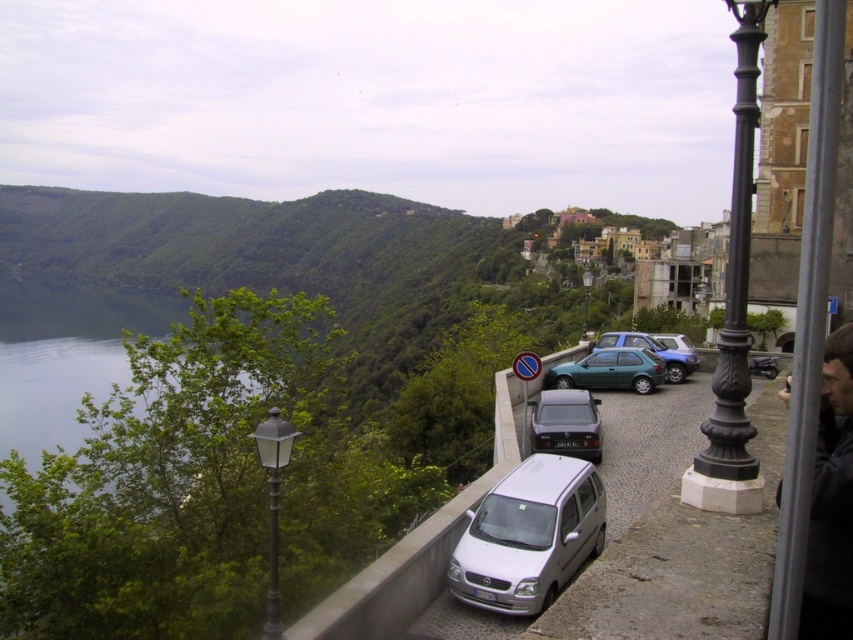
Between point (585, 435) and point (675, 364), which one is positioned in front?

Point (585, 435) is in front.

Can you confirm if metallic gray sedan at center is taller than metallic blue hatchback at center?

Incorrect, metallic gray sedan at center's height is not larger of metallic blue hatchback at center's.

This screenshot has width=853, height=640. Find the location of `metallic gray sedan at center`. metallic gray sedan at center is located at coordinates (566, 422).

You are a GUI agent. You are given a task and a screenshot of the screen. Output one action in this format:
    pyautogui.click(x=<x>, y=<y>)
    Task: Click on the metallic gray sedan at center
    This screenshot has width=853, height=640.
    Given the screenshot: What is the action you would take?
    pyautogui.click(x=566, y=422)

Does black metal pole at right have a lesser height compared to black metal lamp post at center?

No.

Which is behind, point (741, 269) or point (584, 333)?

Point (584, 333)

The width and height of the screenshot is (853, 640). Find the location of `black metal pole at right`. black metal pole at right is located at coordinates (734, 307).

Who is higher up, silver metallic van at lower center or metallic blue hatchback at center?

metallic blue hatchback at center is above.

Looking at this image, is silver metallic van at lower center above metallic blue hatchback at center?

No.

Does point (558, 540) lie behind point (619, 339)?

No, it is in front of (619, 339).

Where is `silver metallic van at lower center`? Image resolution: width=853 pixels, height=640 pixels. silver metallic van at lower center is located at coordinates (529, 536).